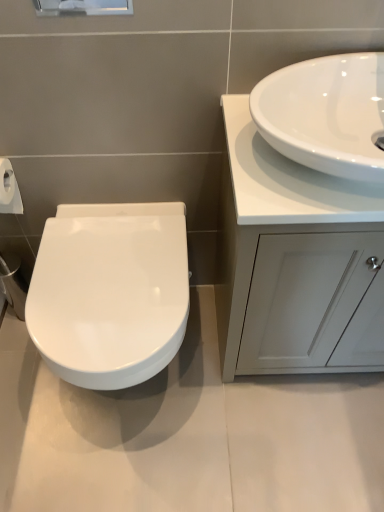
Image resolution: width=384 pixels, height=512 pixels. Find the location of `vacant space situated above white glossy toilet at left (from a real-world perspective)`. vacant space situated above white glossy toilet at left (from a real-world perspective) is located at coordinates (109, 271).